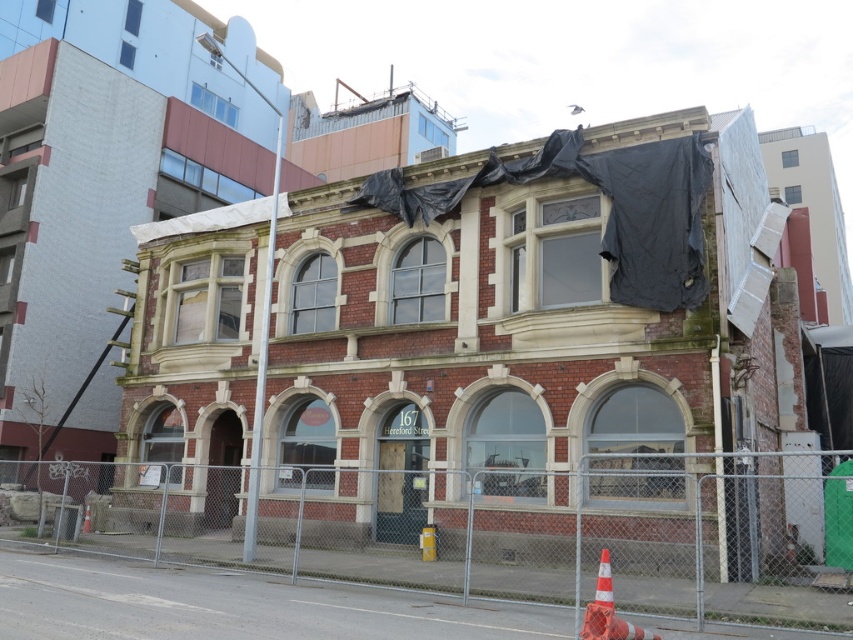
Can you confirm if metal chain-link fence at center is shorter than orange reflective cone at lower right?

In fact, metal chain-link fence at center may be taller than orange reflective cone at lower right.

Describe the element at coordinates (585, 532) in the screenshot. The width and height of the screenshot is (853, 640). I see `metal chain-link fence at center` at that location.

Between point (846, 524) and point (606, 600), which one is positioned in front?

Positioned in front is point (606, 600).

You are a GUI agent. You are given a task and a screenshot of the screen. Output one action in this format:
    pyautogui.click(x=<x>, y=<y>)
    Task: Click on the metal chain-link fence at center
    The image size is (853, 640).
    Given the screenshot: What is the action you would take?
    pyautogui.click(x=585, y=532)

Which is below, metal chain-link fence at center or orange reflective cone at center?

orange reflective cone at center

Is metal chain-link fence at center to the left of orange reflective cone at center from the viewer's perspective?

In fact, metal chain-link fence at center is to the right of orange reflective cone at center.

Identify the location of metal chain-link fence at center. The height and width of the screenshot is (640, 853). (585, 532).

Measure the distance between orange reflective cone at lower right and camera.

A distance of 22.86 feet exists between orange reflective cone at lower right and camera.

Is orange reflective cone at lower right behind orange reflective cone at center?

No, orange reflective cone at lower right is closer to the viewer.

What do you see at coordinates (608, 611) in the screenshot? The height and width of the screenshot is (640, 853). I see `orange reflective cone at lower right` at bounding box center [608, 611].

What are the coordinates of `orange reflective cone at lower right` in the screenshot? It's located at (608, 611).